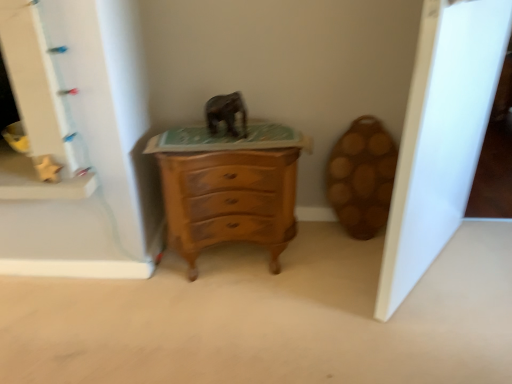
Where is `vacant area that lies to the right of wooden chest of drawers at center`? vacant area that lies to the right of wooden chest of drawers at center is located at coordinates (333, 260).